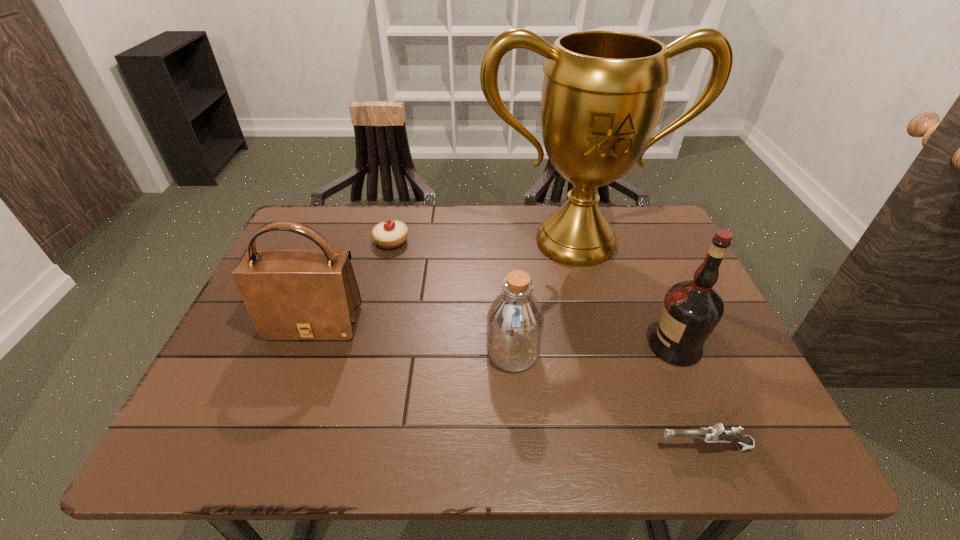
Where is `trophy cup that is at the right edge`? Image resolution: width=960 pixels, height=540 pixels. trophy cup that is at the right edge is located at coordinates (602, 94).

Identify the location of liquor that is at the right edge. Image resolution: width=960 pixels, height=540 pixels. (691, 310).

Locate an element on the screen. The height and width of the screenshot is (540, 960). gun located in the right edge section of the desktop is located at coordinates (717, 433).

This screenshot has height=540, width=960. Find the location of `object present at the far right corner`. object present at the far right corner is located at coordinates (602, 94).

Locate an element on the screen. The image size is (960, 540). object that is at the near right corner is located at coordinates (717, 433).

Find the location of a particular element. This screenshot has width=960, height=540. vacant area at the far edge of the desktop is located at coordinates (492, 213).

This screenshot has height=540, width=960. I want to click on free location at the near edge of the desktop, so click(x=350, y=426).

I want to click on vacant position at the left edge of the desktop, so tap(228, 355).

I want to click on vacant space at the far left corner, so click(x=338, y=233).

Where is `free location at the far right corner of the desktop`? This screenshot has height=540, width=960. free location at the far right corner of the desktop is located at coordinates (622, 243).